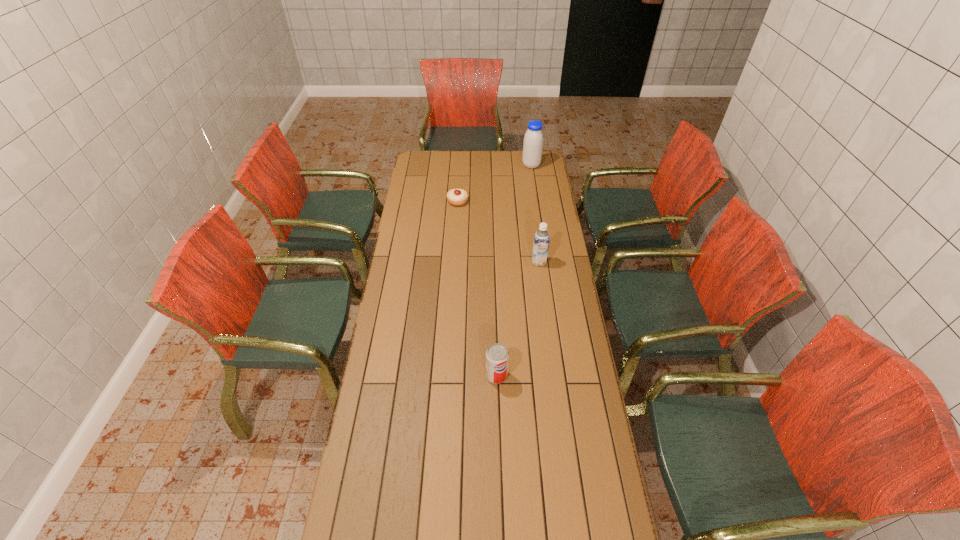
Locate an element on the screen. vacant space that is in between the tallest object and the pastry is located at coordinates (494, 184).

You are a GUI agent. You are given a task and a screenshot of the screen. Output one action in this format:
    pyautogui.click(x=<x>, y=<y>)
    Task: Click on the free space that is in between the third farthest object and the pastry
    The image size is (960, 540).
    Given the screenshot: What is the action you would take?
    pyautogui.click(x=498, y=232)

Find the location of a particular element. The width and height of the screenshot is (960, 540). empty space between the pastry and the second nearest object is located at coordinates (498, 232).

Where is `vacant region between the pastry and the third tallest object`? The width and height of the screenshot is (960, 540). vacant region between the pastry and the third tallest object is located at coordinates (477, 288).

Find the location of a particular element. This screenshot has width=960, height=540. vacant space in between the second farthest object and the second shortest object is located at coordinates (477, 288).

Where is `unoccupied position between the third nearest object and the third object from right to left`? This screenshot has height=540, width=960. unoccupied position between the third nearest object and the third object from right to left is located at coordinates (477, 288).

Where is `the third closest object relative to the shortest object`? the third closest object relative to the shortest object is located at coordinates (497, 356).

This screenshot has height=540, width=960. I want to click on object that stands as the third closest to the third farthest object, so click(x=533, y=140).

Identify the location of free spot that satisfies the following two spatial constraints: 1. on the back side of the soda; 2. on the right side of the taller soya milk. (491, 165).